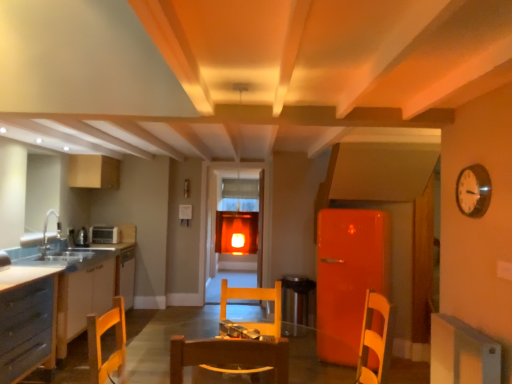
Question: From a real-world perspective, is wooden round table at center above or below transparent glass door at center?

Choices:
 (A) below
 (B) above

Answer: (A)

Question: From the image's perspective, is wooden round table at center above or below transparent glass door at center?

Choices:
 (A) above
 (B) below

Answer: (B)

Question: Estimate the real-world distances between objects in this image. Which object is farther from the wooden round table at center?

Choices:
 (A) white glossy clock at upper right
 (B) white matte cabinet at lower right, marked as the first cabinetry in a right-to-left arrangement
 (C) white plastic toaster at left
 (D) wooden chair at center
 (E) matte wood cabinet at upper left, which ranks as the 1th cabinetry in top-to-bottom order

Answer: (E)

Question: Estimate the real-world distances between objects in this image. Which object is closer to the wooden chair at center?

Choices:
 (A) white plastic toaster at left
 (B) white matte cabinet at lower right, which ranks as the second cabinetry in top-to-bottom order
 (C) transparent glass door at center
 (D) matte gray cabinet at left, acting as the second cabinetry starting from the left
 (E) wooden round table at center

Answer: (C)